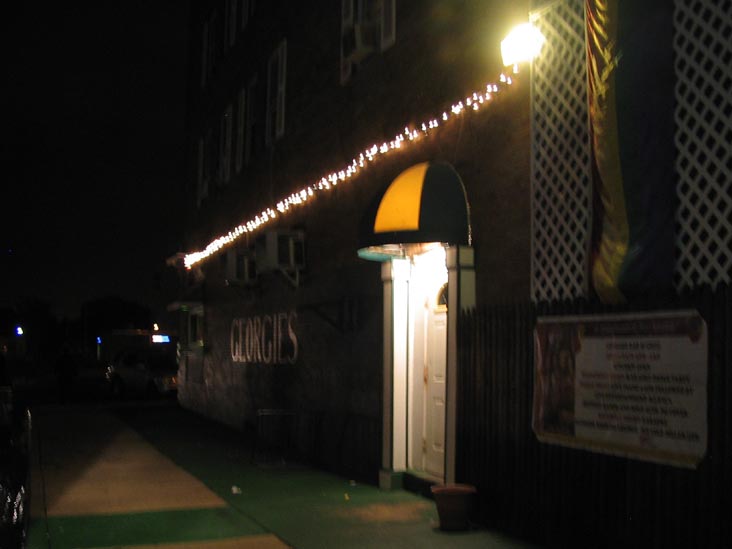
Locate an element on the screen. light is located at coordinates (162, 339).